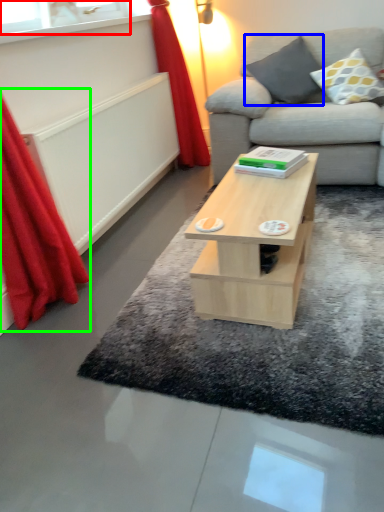
Question: Based on their relative distances, which object is farther from window (highlighted by a red box)? Choose from pillow (highlighted by a blue box) and curtain (highlighted by a green box).

Choices:
 (A) pillow
 (B) curtain

Answer: (A)